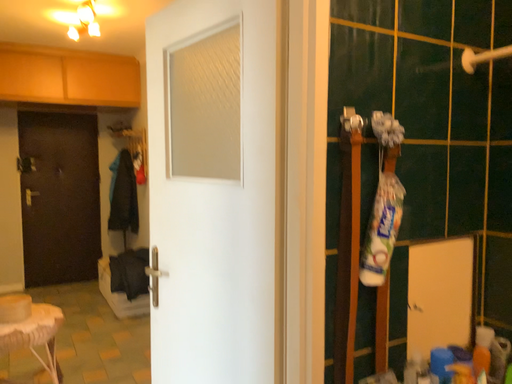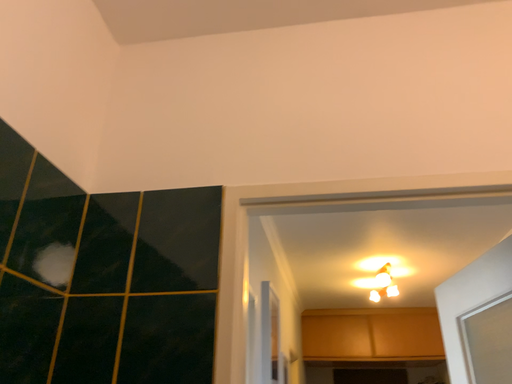
Question: How did the camera likely rotate when shooting the video?

Choices:
 (A) rotated left
 (B) rotated right

Answer: (A)